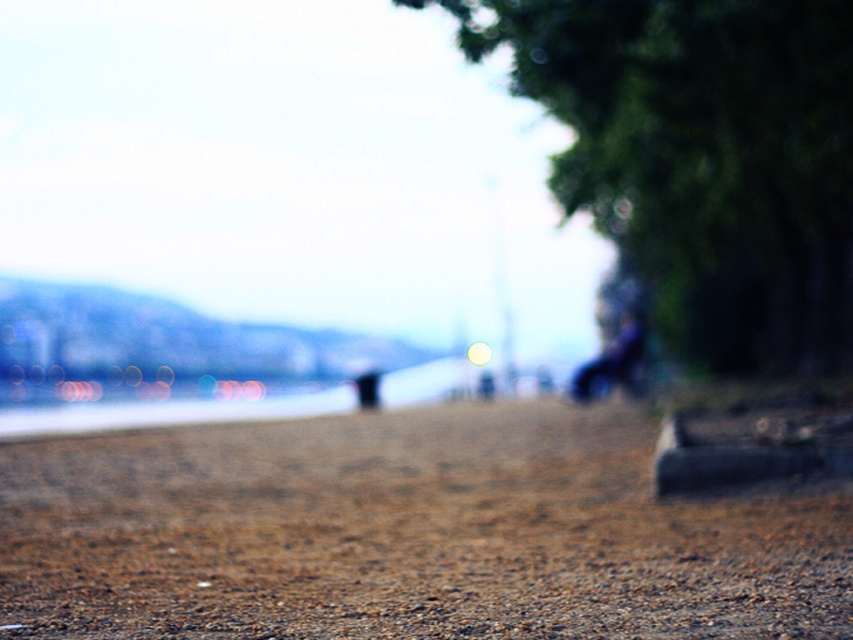
Is green leafy tree at upper right positioned behind dark blue fabric at right?

That is False.

In the scene shown: Can you confirm if green leafy tree at upper right is smaller than dark blue fabric at right?

No, green leafy tree at upper right is not smaller than dark blue fabric at right.

You are a GUI agent. You are given a task and a screenshot of the screen. Output one action in this format:
    pyautogui.click(x=<x>, y=<y>)
    Task: Click on the green leafy tree at upper right
    
    Given the screenshot: What is the action you would take?
    pyautogui.click(x=701, y=157)

Locate an element on the screen. The width and height of the screenshot is (853, 640). green leafy tree at upper right is located at coordinates (701, 157).